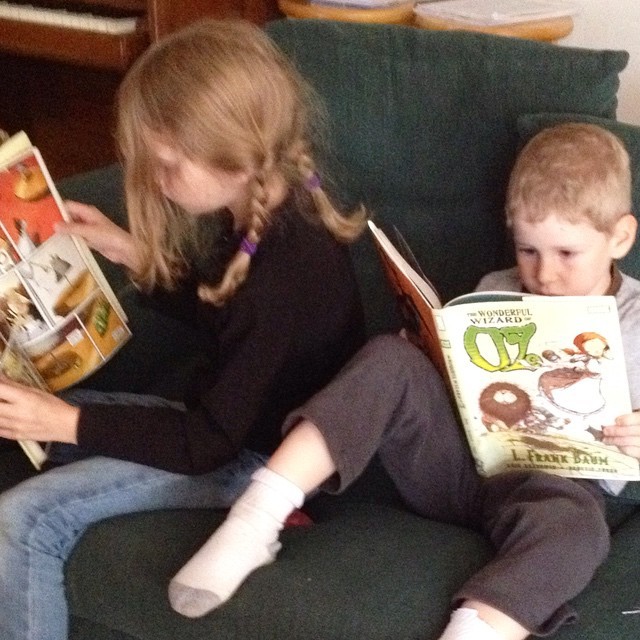
What are the coordinates of `black cushion` in the screenshot? It's located at click(450, 164).